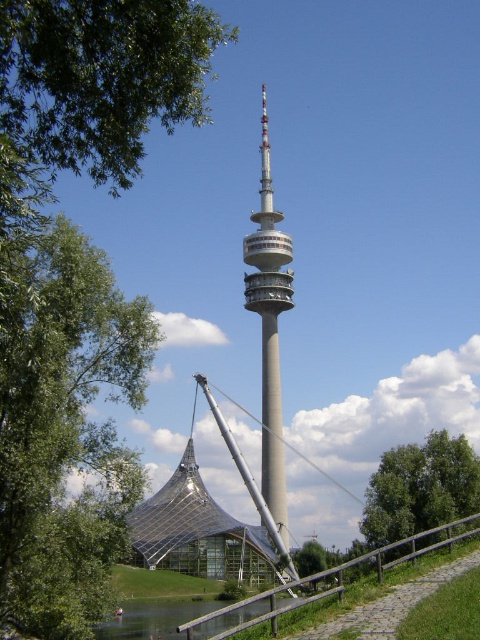
Locate an element on the screen. This screenshot has width=480, height=640. green leafy tree at left is located at coordinates (66, 433).

Does green leafy tree at left have a greater height compared to green leafy tree at lower right?

Yes, green leafy tree at left is taller than green leafy tree at lower right.

Is point (131, 486) more distant than point (458, 508)?

No.

Where is `green leafy tree at left`? This screenshot has height=640, width=480. green leafy tree at left is located at coordinates (66, 433).

The height and width of the screenshot is (640, 480). What do you see at coordinates (202, 522) in the screenshot? I see `transparent glass tent at center` at bounding box center [202, 522].

Between transparent glass tent at center and green leafy tree at lower right, which one has more height?

transparent glass tent at center is taller.

Where is `transparent glass tent at center`? The image size is (480, 640). transparent glass tent at center is located at coordinates (202, 522).

Is green leafy tree at lower right further to camera compared to silver metallic tower at center?

No, green leafy tree at lower right is in front of silver metallic tower at center.

Does green leafy tree at lower right have a smaller size compared to silver metallic tower at center?

Indeed, green leafy tree at lower right has a smaller size compared to silver metallic tower at center.

Who is more distant from viewer, (448, 502) or (282, 433)?

Positioned behind is point (282, 433).

Locate an element on the screen. green leafy tree at lower right is located at coordinates (420, 486).